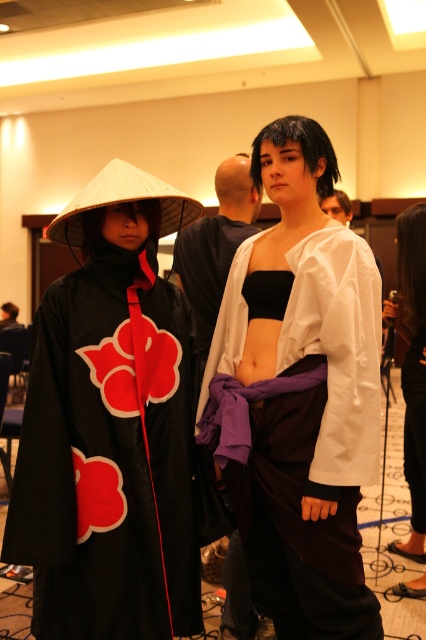
Question: Does matte black kimono at center have a lesser width compared to matte black top at center?

Choices:
 (A) no
 (B) yes

Answer: (A)

Question: Can you confirm if black matte kimono at left is positioned below matte black pants at center?

Choices:
 (A) yes
 (B) no

Answer: (B)

Question: Which point appears farthest from the camera in this image?

Choices:
 (A) (215, 340)
 (B) (420, 360)

Answer: (B)

Question: Which object is farther from the camera taking this photo?

Choices:
 (A) white matte kimono at center
 (B) matte black kimono at center
 (C) matte black top at center
 (D) black matte kimono at left

Answer: (B)

Question: Is matte black pants at center bigger than matte black top at center?

Choices:
 (A) no
 (B) yes

Answer: (B)

Question: Which point is closer to the camera?

Choices:
 (A) (206, 358)
 (B) (365, 400)

Answer: (B)